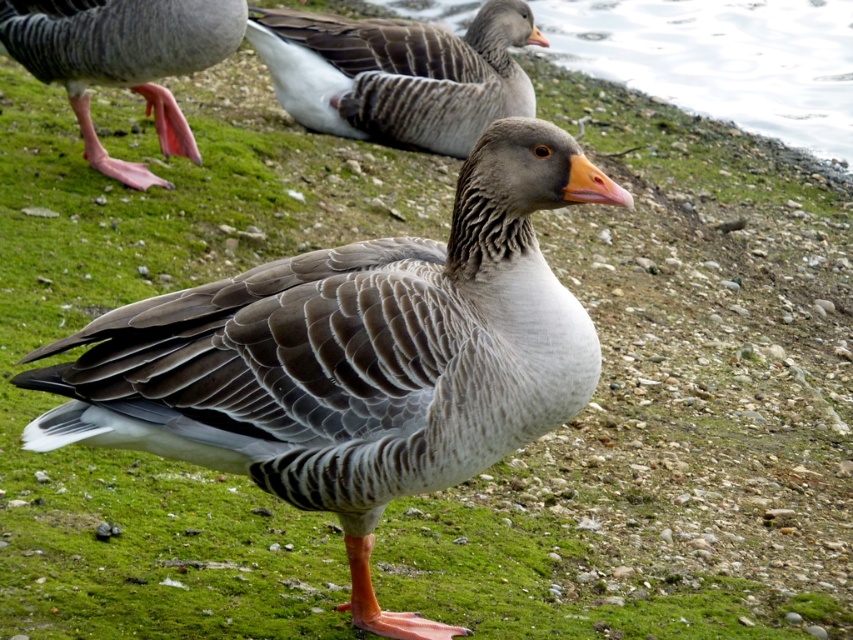
Which is behind, point (164, 298) or point (318, 20)?

The point (318, 20) is more distant.

Does gray matte duck at center have a lesser height compared to gray feathered goose at upper center?

In fact, gray matte duck at center may be taller than gray feathered goose at upper center.

Is point (126, 429) behind point (315, 67)?

No, it is not.

The height and width of the screenshot is (640, 853). Find the location of `gray matte duck at center`. gray matte duck at center is located at coordinates (355, 358).

Can you confirm if gray feathered goose at upper center is thinner than pink rubber feet at lower left?

No.

From the picture: Who is shorter, gray feathered goose at upper center or pink rubber feet at lower left?

pink rubber feet at lower left

This screenshot has height=640, width=853. In order to click on gray feathered goose at upper center in this screenshot , I will do `click(397, 74)`.

Can you confirm if gray matte duck at center is shorter than pink rubber feet at lower left?

No.

Describe the element at coordinates (355, 358) in the screenshot. The image size is (853, 640). I see `gray matte duck at center` at that location.

Where is `gray matte duck at center`? gray matte duck at center is located at coordinates (355, 358).

Where is `gray matte duck at center`? This screenshot has width=853, height=640. gray matte duck at center is located at coordinates (355, 358).